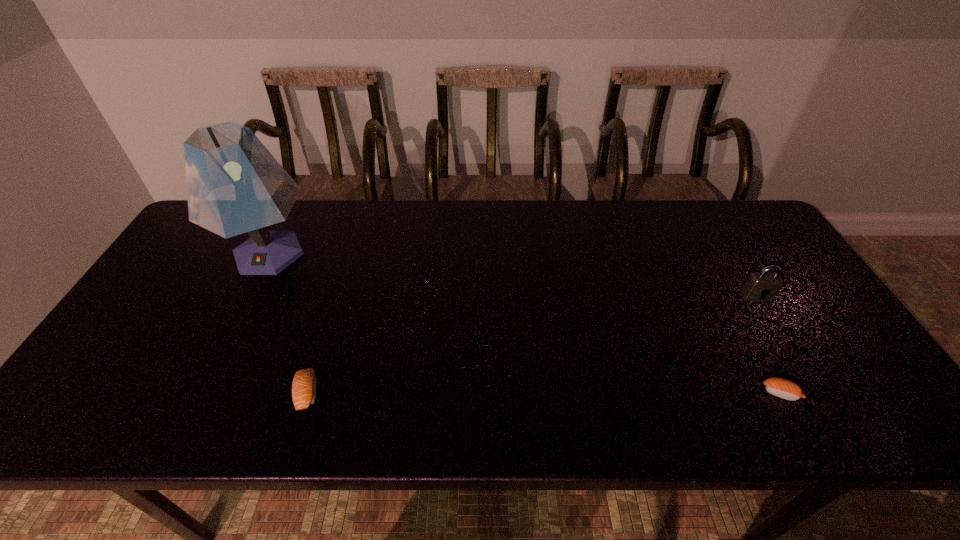
This screenshot has width=960, height=540. What are the coordinates of `the farthest object` in the screenshot? It's located at (234, 184).

Image resolution: width=960 pixels, height=540 pixels. In order to click on lampshade in this screenshot , I will do `click(234, 184)`.

Where is `the third nearest object`? The image size is (960, 540). the third nearest object is located at coordinates (762, 286).

Image resolution: width=960 pixels, height=540 pixels. What are the coordinates of `the third shortest object` in the screenshot? It's located at (762, 286).

You are a GUI agent. You are given a task and a screenshot of the screen. Output one action in this format:
    pyautogui.click(x=<x>, y=<y>)
    Task: Click on the left sushi
    The height and width of the screenshot is (540, 960).
    Given the screenshot: What is the action you would take?
    pyautogui.click(x=304, y=386)

Where is `the right sushi`? the right sushi is located at coordinates (783, 388).

Locate an element on the screen. The width and height of the screenshot is (960, 540). free space located 0.140m on the base of the farthest object is located at coordinates (231, 329).

Find the location of a particular element. The height and width of the screenshot is (540, 960). vacant space situated at the front of the third nearest object near the keyhole is located at coordinates click(774, 326).

This screenshot has height=540, width=960. Identify the location of vacant space positioned on the left of the third object from right to left. (141, 393).

This screenshot has width=960, height=540. I want to click on vacant space located on the left of the right sushi, so click(635, 393).